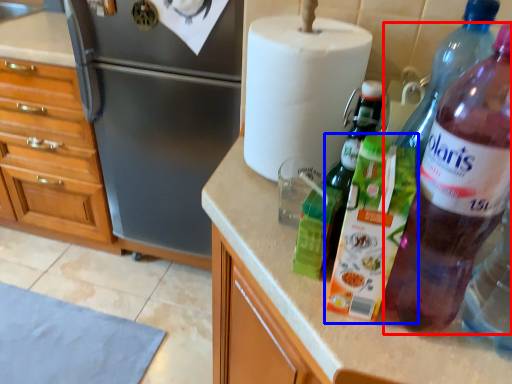
Question: Which object is closer to the camera taking this photo, bottle (highlighted by a red box) or bottle (highlighted by a blue box)?

Choices:
 (A) bottle
 (B) bottle

Answer: (A)